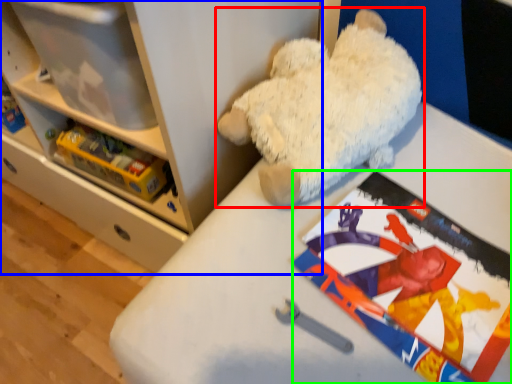
Question: Which is nearer to the teddy bear (highlighted by a red box)? shelf (highlighted by a blue box) or comic book (highlighted by a green box).

Choices:
 (A) shelf
 (B) comic book

Answer: (B)